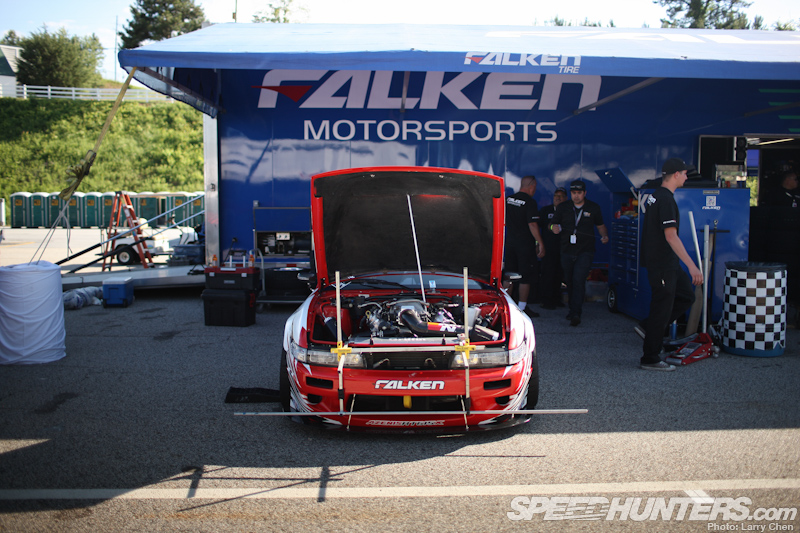
The height and width of the screenshot is (533, 800). I want to click on tool chest, so click(630, 240).